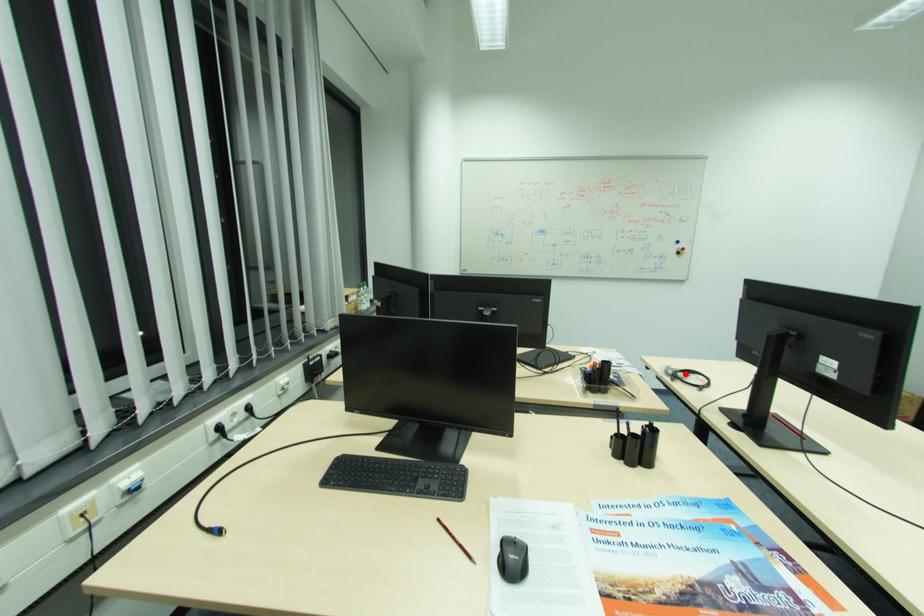
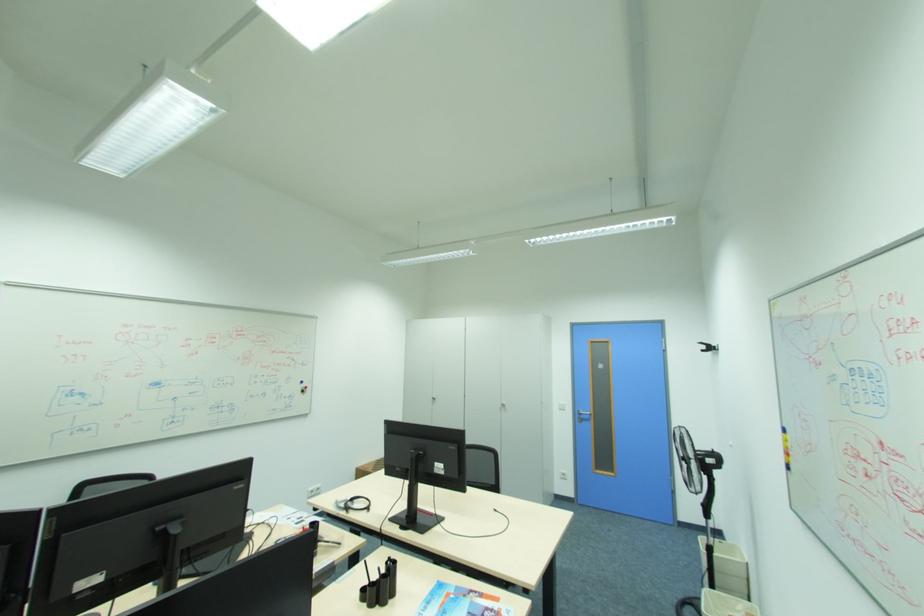
Question: I am providing you with two images of the same scene from different viewpoints. Image1 has a red point marked. In image2, the corresponding 3D location appears at what relative position? Reply with the corresponding letter.

Choices:
 (A) Closer
 (B) Farther

Answer: (A)